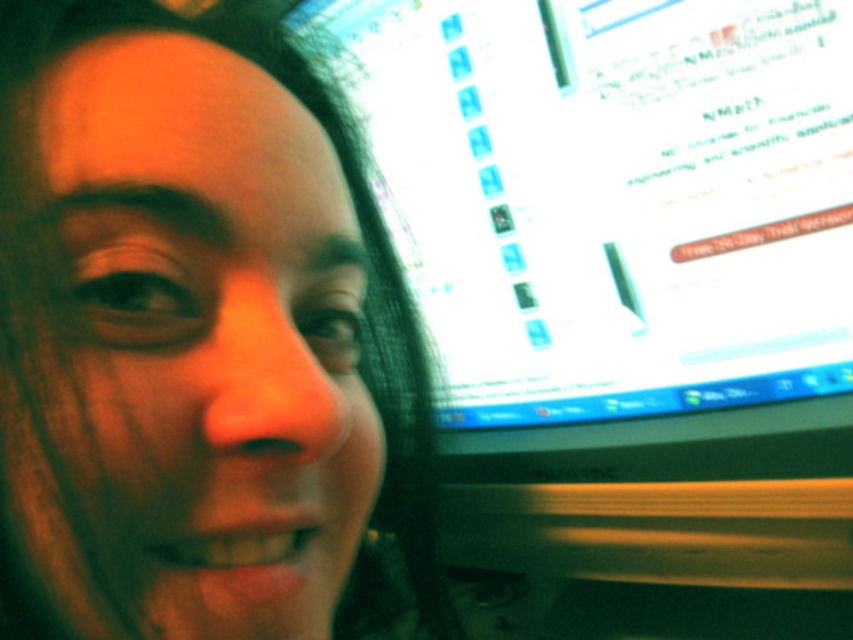
You are a photographer checking the lighting setup for a portrait session. You notice the matte skin at center and the matte plastic monitor at upper right in the frame. Which object is closer to the camera lens?

The matte skin at center is closer to the camera lens because it is in front of the matte plastic monitor at upper right.

You are a photographer adjusting the lighting for a portrait. The subject has matte skin at center. To ensure even lighting, you need to position a reflector precisely. Where should you place the reflector relative to the subject to catch the light from the computer monitor? Use the coordinates provided to determine the best position.

The matte skin at center is located at coordinates point (196, 342). To effectively reflect light from the computer monitor onto the matte skin at center, position the reflector slightly below and to the right of the subject, aligning with the monitor.